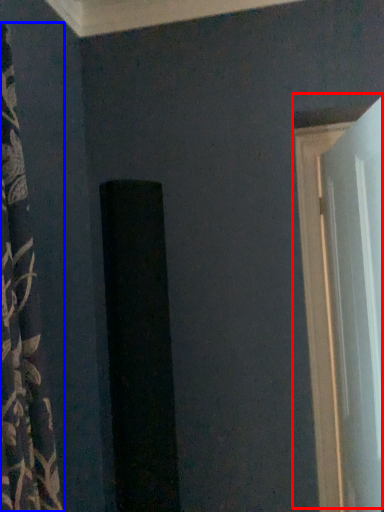
Question: Which of the following is the farthest to the observer, door (highlighted by a red box) or curtain (highlighted by a blue box)?

Choices:
 (A) door
 (B) curtain

Answer: (A)